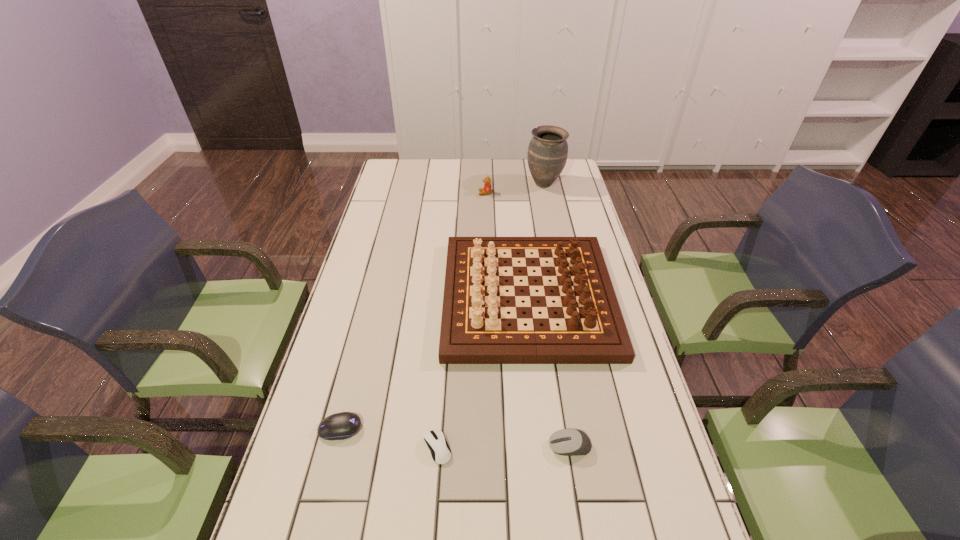
The width and height of the screenshot is (960, 540). Find the location of `object that is at the left edge`. object that is at the left edge is located at coordinates (339, 426).

Identify the location of urn that is at the right edge. The height and width of the screenshot is (540, 960). (547, 154).

I want to click on gameboard located at the right edge, so click(474, 326).

This screenshot has width=960, height=540. I want to click on object situated at the far right corner, so click(x=547, y=154).

This screenshot has height=540, width=960. In the image, there is a desktop. Find the location of `free space at the far edge`. free space at the far edge is located at coordinates (521, 173).

What are the coordinates of `free location at the left edge` in the screenshot? It's located at (360, 275).

Find the location of a particular element. Image resolution: width=960 pixels, height=540 pixels. vacant area at the right edge of the desktop is located at coordinates (573, 187).

Find the location of a particular element. free space at the far left corner of the desktop is located at coordinates (403, 159).

Where is `vacant area that lies between the leftmost object and the rightmost mouse`? This screenshot has height=540, width=960. vacant area that lies between the leftmost object and the rightmost mouse is located at coordinates (455, 437).

Find the location of a particular element. The width and height of the screenshot is (960, 540). free space between the leftmost mouse and the rightmost mouse is located at coordinates (455, 437).